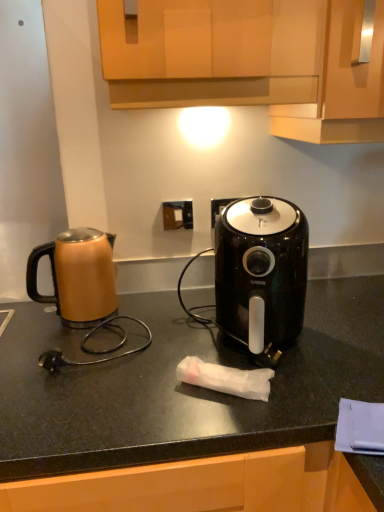
Question: In terms of width, does white plastic electric outlet at center look wider or thinner when compared to black matte countertop at center?

Choices:
 (A) wide
 (B) thin

Answer: (B)

Question: Is white plastic electric outlet at center inside the boundaries of black matte countertop at center, or outside?

Choices:
 (A) outside
 (B) inside

Answer: (A)

Question: Which object is positioned closest to the wooden cabinet at upper center, which appears as the first cabinetry when viewed from the right?

Choices:
 (A) black matte countertop at center
 (B) white plastic electric outlet at center
 (C) wooden cabinet at upper center, arranged as the second cabinetry when viewed from the right
 (D) matte brown kettle at left
 (E) black glossy air fryer at center

Answer: (C)

Question: Which object is positioned farthest from the white plastic electric outlet at center?

Choices:
 (A) black glossy air fryer at center
 (B) black matte countertop at center
 (C) wooden cabinet at upper center, arranged as the 1th cabinetry when viewed from the left
 (D) wooden cabinet at upper center, which appears as the first cabinetry when viewed from the right
 (E) matte brown kettle at left

Answer: (B)